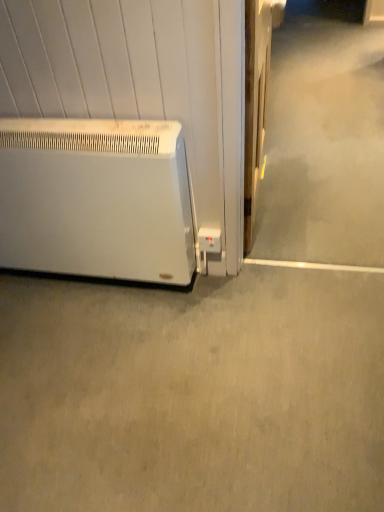
Question: Looking at the image, does gray matte concrete at lower left seem bigger or smaller compared to white matte heater at lower left?

Choices:
 (A) big
 (B) small

Answer: (B)

Question: Would you say gray matte concrete at lower left is to the left or to the right of white matte heater at lower left in the picture?

Choices:
 (A) right
 (B) left

Answer: (A)

Question: Considering the positions of gray matte concrete at lower left and white matte heater at lower left in the image, is gray matte concrete at lower left taller or shorter than white matte heater at lower left?

Choices:
 (A) short
 (B) tall

Answer: (A)

Question: Would you say white matte heater at lower left is inside or outside gray matte concrete at lower left?

Choices:
 (A) inside
 (B) outside

Answer: (B)

Question: From their relative heights in the image, would you say white matte heater at lower left is taller or shorter than gray matte concrete at lower left?

Choices:
 (A) tall
 (B) short

Answer: (A)

Question: In the image, is white matte heater at lower left positioned in front of or behind gray matte concrete at lower left?

Choices:
 (A) front
 (B) behind

Answer: (B)

Question: From the image's perspective, is white matte heater at lower left above or below gray matte concrete at lower left?

Choices:
 (A) above
 (B) below

Answer: (A)